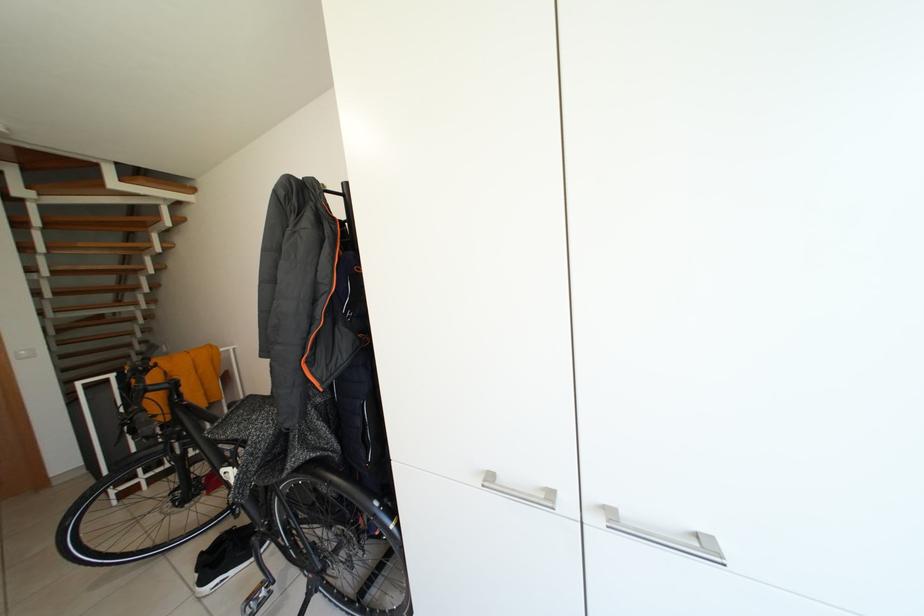
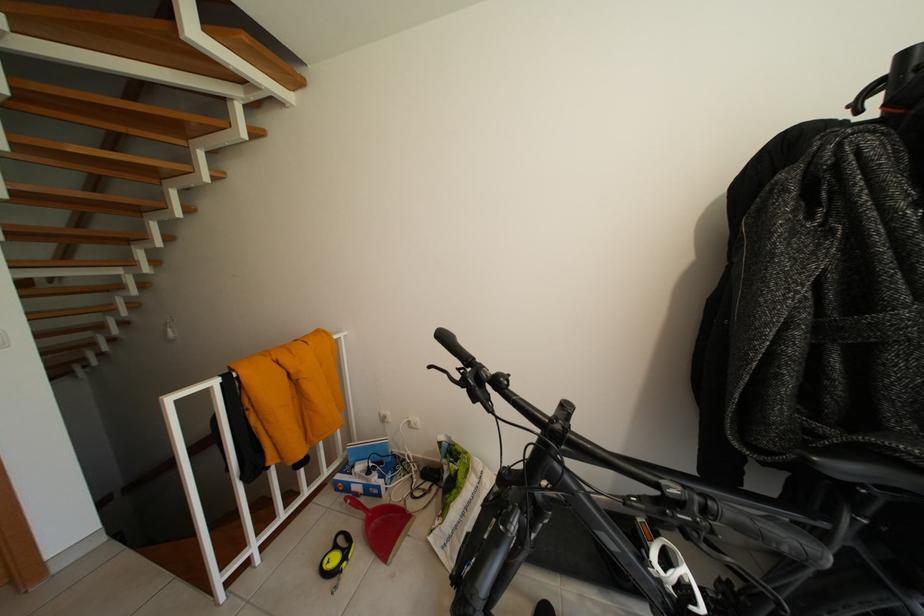
The point at (151,229) is marked in the first image. Where is the corresponding point in the second image?

(190, 137)